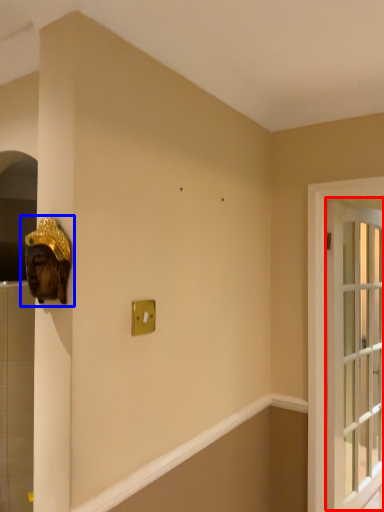
Question: Which object appears farthest to the camera in this image, window (highlighted by a red box) or sculpture (highlighted by a blue box)?

Choices:
 (A) window
 (B) sculpture

Answer: (A)